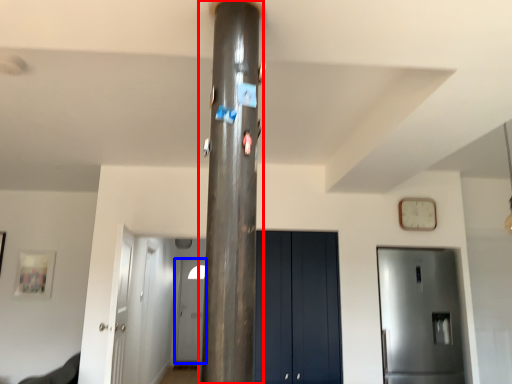
Question: Which point is closer to the camera, pillar (highlighted by a red box) or door (highlighted by a blue box)?

Choices:
 (A) pillar
 (B) door

Answer: (A)